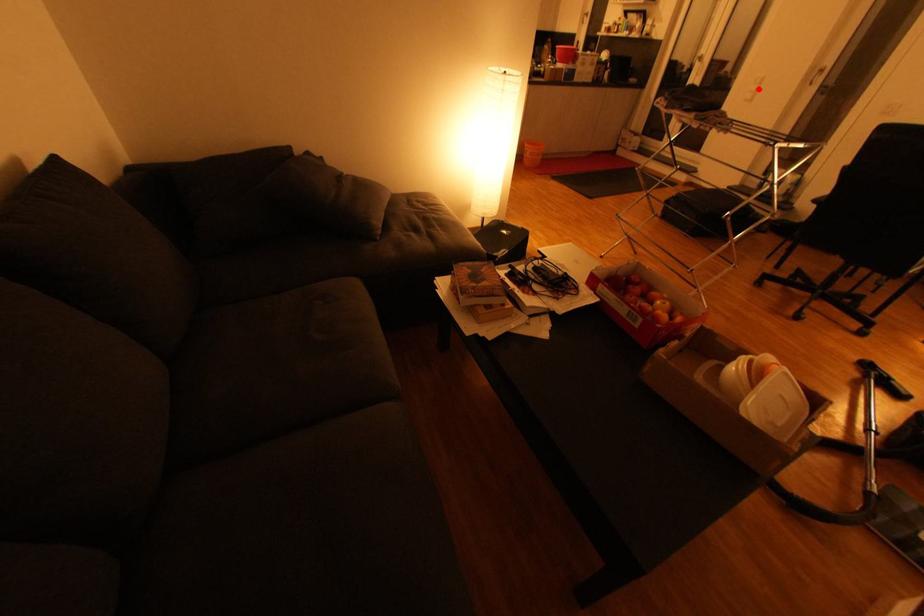
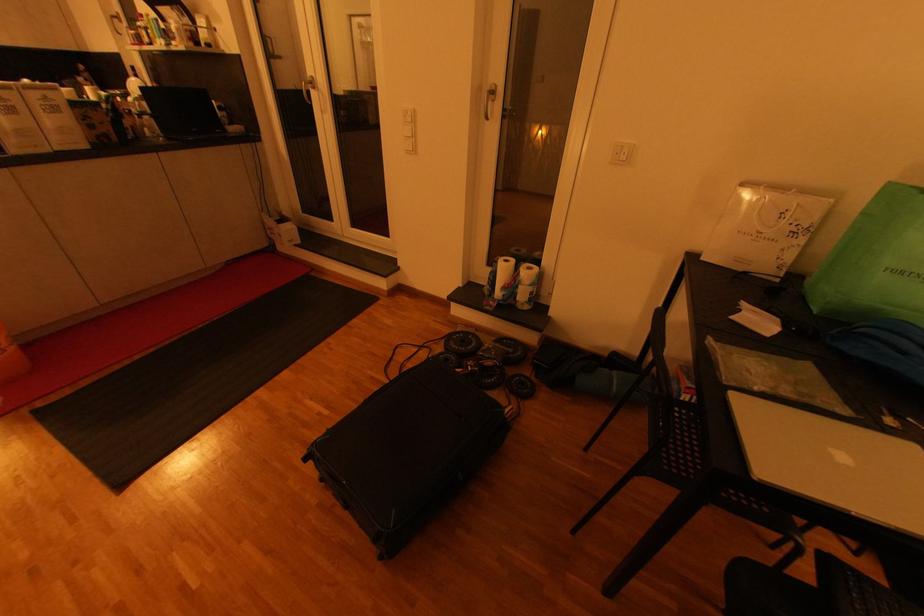
The point at the highlighted location is marked in the first image. Where is the corresponding point in the second image?

(412, 131)